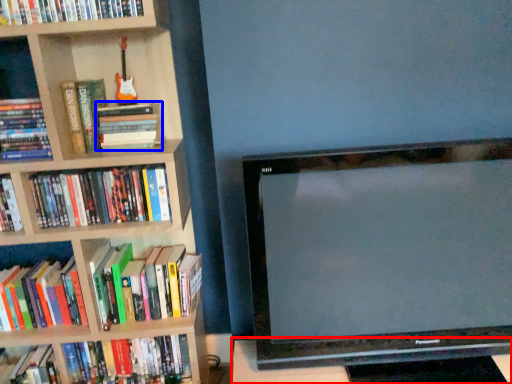
Question: Which object appears closest to the camera in this image, table (highlighted by a red box) or book (highlighted by a blue box)?

Choices:
 (A) table
 (B) book

Answer: (A)